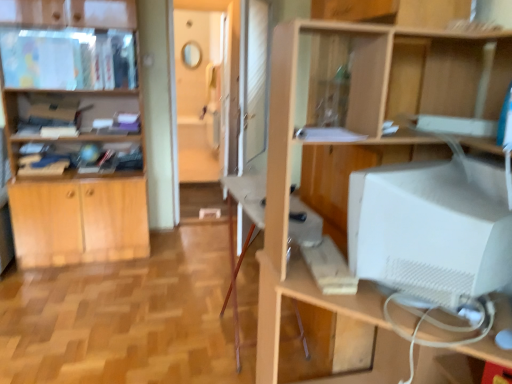
Question: Considering the relative positions of white matte computer monitor at right and white matte computer tower at right in the image provided, is white matte computer monitor at right behind white matte computer tower at right?

Choices:
 (A) yes
 (B) no

Answer: (A)

Question: Could you tell me if white matte computer monitor at right is turned towards white matte computer tower at right?

Choices:
 (A) yes
 (B) no

Answer: (A)

Question: Does white matte computer monitor at right contain white matte computer tower at right?

Choices:
 (A) yes
 (B) no

Answer: (B)

Question: From the image's perspective, is white matte computer monitor at right located beneath white matte computer tower at right?

Choices:
 (A) no
 (B) yes

Answer: (A)

Question: Does white matte computer monitor at right have a smaller size compared to white matte computer tower at right?

Choices:
 (A) no
 (B) yes

Answer: (B)

Question: Considering the relative sizes of white matte computer monitor at right and white matte computer tower at right in the image provided, is white matte computer monitor at right taller than white matte computer tower at right?

Choices:
 (A) yes
 (B) no

Answer: (B)

Question: Is white matte computer monitor at right positioned far away from light wood cabinet at left?

Choices:
 (A) no
 (B) yes

Answer: (B)

Question: Does white matte computer monitor at right have a larger size compared to light wood cabinet at left?

Choices:
 (A) yes
 (B) no

Answer: (B)

Question: Is white matte computer monitor at right positioned with its back to light wood cabinet at left?

Choices:
 (A) yes
 (B) no

Answer: (B)

Question: Is white matte computer monitor at right wider than light wood cabinet at left?

Choices:
 (A) no
 (B) yes

Answer: (A)

Question: Can you confirm if white matte computer monitor at right is taller than light wood cabinet at left?

Choices:
 (A) no
 (B) yes

Answer: (A)

Question: Can you confirm if white matte computer monitor at right is positioned to the right of light wood cabinet at left?

Choices:
 (A) yes
 (B) no

Answer: (A)

Question: Can you confirm if matte wooden cabinet at upper left is bigger than light wood cabinet at left?

Choices:
 (A) no
 (B) yes

Answer: (A)